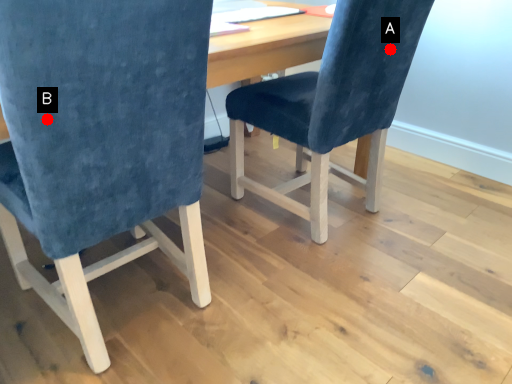
Question: Two points are circled on the image, labeled by A and B beside each circle. Which of the following is the farthest from the observer?

Choices:
 (A) A is further
 (B) B is further

Answer: (A)